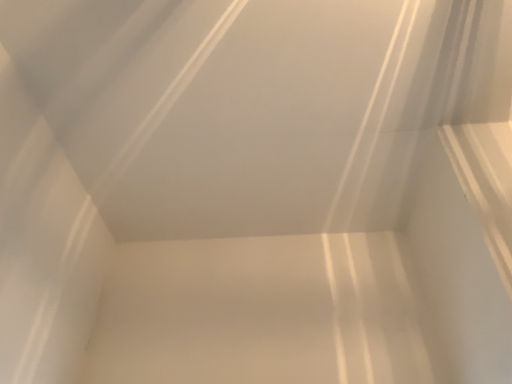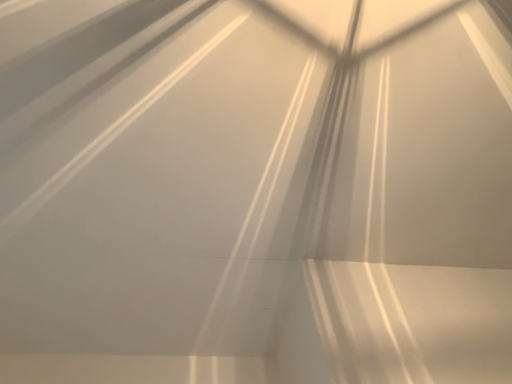
Question: How did the camera likely rotate when shooting the video?

Choices:
 (A) rotated left
 (B) rotated right

Answer: (B)